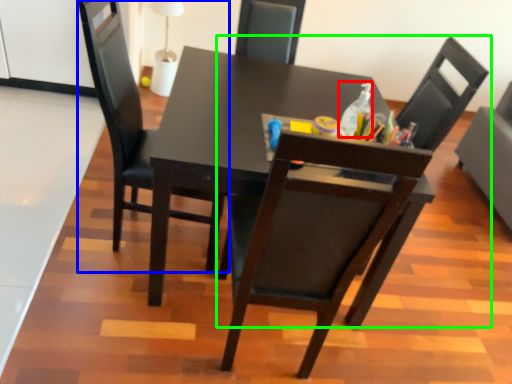
Question: Based on their relative distances, which object is nearer to bottle (highlighted by a red box)? Choose from chair (highlighted by a blue box) and chair (highlighted by a green box).

Choices:
 (A) chair
 (B) chair

Answer: (B)